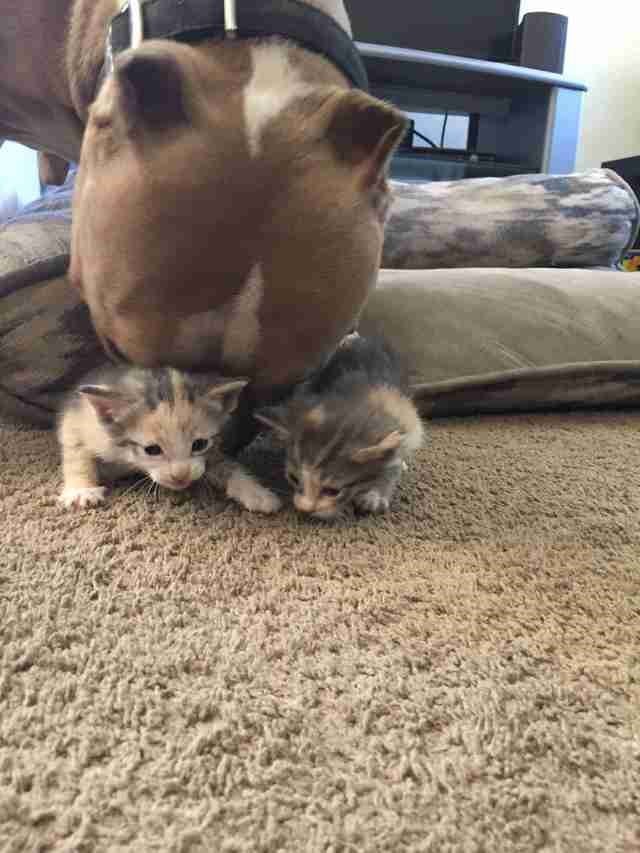
Where is `stand`? The height and width of the screenshot is (853, 640). stand is located at coordinates (563, 102).